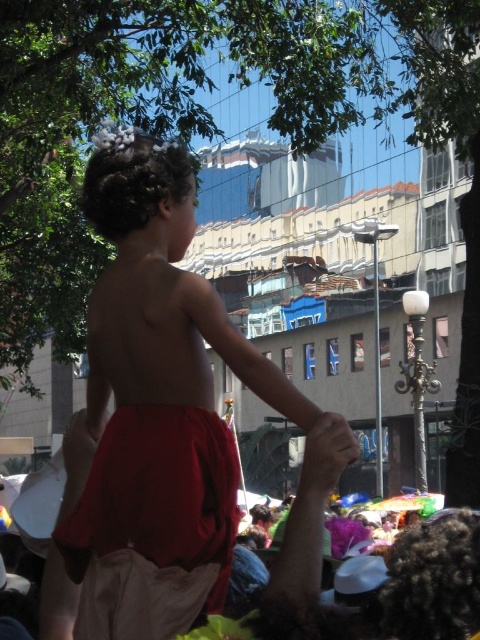
You are a photographer trying to capture the child in the scene. Since both the red cotton shorts at center and the red fabric at center are present, which one should you focus on to ensure the subject is clearly visible in your photo?

The red cotton shorts at center is larger in size than the red fabric at center, so focusing on the red cotton shorts at center will make the subject more visible in the photo.

You are a photographer trying to capture a candid shot of the child in the scene. The child is wearing red cotton shorts at center and holding a smooth skin hand at center. Which object should you focus on first to ensure the child is in focus?

The red cotton shorts at center is further to the viewer than the smooth skin hand at center, so you should focus on the red cotton shorts at center first to ensure the child is in focus.

You are a photographer trying to capture a candid shot of the child and the adult holding hands in the crowd. The red fabric at center and the smooth skin hand at center are both in your camera frame. Which object should you focus on first if you want to ensure both are in focus?

The red fabric at center is taller than the smooth skin hand at center, so focusing on the red fabric at center first would help ensure both are in focus since it is larger and more prominent in the frame.